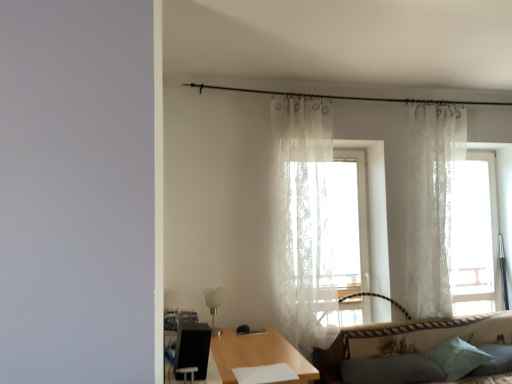
Describe the element at coordinates (391, 370) in the screenshot. The width and height of the screenshot is (512, 384). I see `dark gray fabric pillow at lower right, the 1th pillow positioned from the left` at that location.

What do you see at coordinates (192, 350) in the screenshot? The width and height of the screenshot is (512, 384). I see `black textured swivel chair at lower left` at bounding box center [192, 350].

Find the location of a particular element. The image size is (512, 384). black textured swivel chair at lower left is located at coordinates (192, 350).

Measure the distance between light blue fabric pillow at lower right, the 2th pillow positioned from the left, and camera.

light blue fabric pillow at lower right, the 2th pillow positioned from the left, and camera are 2.96 meters apart.

Describe the element at coordinates (214, 305) in the screenshot. The width and height of the screenshot is (512, 384). I see `white glass lamp at lower center` at that location.

What do you see at coordinates (413, 350) in the screenshot? The height and width of the screenshot is (384, 512). I see `patterned fabric couch at lower right` at bounding box center [413, 350].

Measure the distance between point (440, 276) and camera.

3.36 meters.

You are a GUI agent. You are given a task and a screenshot of the screen. Output one action in this format:
    pyautogui.click(x=<x>, y=<y>)
    Task: Click on the dark gray fabric pillow at lower right, acting as the third pillow starting from the right
    
    Given the screenshot: What is the action you would take?
    pyautogui.click(x=391, y=370)

Looking at this image, considering the relative sizes of sheer white curtain at center, the second curtain in the right-to-left sequence, and white lace curtain at upper right, which ranks as the 1th curtain in right-to-left order, in the image provided, is sheer white curtain at center, the second curtain in the right-to-left sequence, smaller than white lace curtain at upper right, which ranks as the 1th curtain in right-to-left order,?

No.

Which is more to the left, sheer white curtain at center, which ranks as the first curtain in left-to-right order, or white lace curtain at upper right, the 2th curtain from the left?

Positioned to the left is sheer white curtain at center, which ranks as the first curtain in left-to-right order.

Is sheer white curtain at center, the second curtain in the right-to-left sequence, wider or thinner than white lace curtain at upper right, the 2th curtain from the left?

Considering their sizes, sheer white curtain at center, the second curtain in the right-to-left sequence, looks broader than white lace curtain at upper right, the 2th curtain from the left.

From a real-world perspective, relative to white lace curtain at upper right, which ranks as the 1th curtain in right-to-left order, is sheer white curtain at center, the second curtain in the right-to-left sequence, vertically above or below?

In terms of real-world spatial position, sheer white curtain at center, the second curtain in the right-to-left sequence, is below white lace curtain at upper right, which ranks as the 1th curtain in right-to-left order.

From the image's perspective, is transparent lace curtain at right located above soft blue pillow at lower right, which is the 1th pillow from right to left?

Correct, transparent lace curtain at right appears higher than soft blue pillow at lower right, which is the 1th pillow from right to left, in the image.

Between transparent lace curtain at right and soft blue pillow at lower right, which is the 1th pillow from right to left, which one has smaller width?

transparent lace curtain at right is thinner.

Identify the location of window that is above the soft blue pillow at lower right, acting as the third pillow starting from the left (from a real-world perspective). Image resolution: width=512 pixels, height=384 pixels. (475, 237).

Does transparent lace curtain at right contain soft blue pillow at lower right, acting as the third pillow starting from the left?

No, soft blue pillow at lower right, acting as the third pillow starting from the left, is not surrounded by transparent lace curtain at right.

Does point (465, 341) come farther from viewer compared to point (505, 293)?

That is False.

Measure the distance between light blue fabric pillow at lower right, the 2th pillow positioned from the left, and transparent lace curtain at right.

light blue fabric pillow at lower right, the 2th pillow positioned from the left, and transparent lace curtain at right are 77.09 centimeters apart from each other.

Is light blue fabric pillow at lower right, the 2th pillow positioned from the left, inside or outside of transparent lace curtain at right?

The correct answer is: outside.

From the image's perspective, who appears lower, light blue fabric pillow at lower right, acting as the second pillow starting from the right, or transparent lace curtain at right?

From the image's view, light blue fabric pillow at lower right, acting as the second pillow starting from the right, is below.

Is point (498, 349) positioned before point (490, 154)?

Yes, point (498, 349) is closer to viewer.

Between soft blue pillow at lower right, which is the 1th pillow from right to left, and transparent lace curtain at right, which one has smaller size?

Smaller between the two is soft blue pillow at lower right, which is the 1th pillow from right to left.

Which object is positioned more to the left, soft blue pillow at lower right, acting as the third pillow starting from the left, or transparent lace curtain at right?

soft blue pillow at lower right, acting as the third pillow starting from the left.

From a real-world perspective, is soft blue pillow at lower right, acting as the third pillow starting from the left, physically located above or below transparent lace curtain at right?

From a real-world perspective, soft blue pillow at lower right, acting as the third pillow starting from the left, is physically below transparent lace curtain at right.

Considering the positions of objects patterned fabric couch at lower right and white lace curtain at upper right, the 2th curtain from the left, in the image provided, who is more to the right, patterned fabric couch at lower right or white lace curtain at upper right, the 2th curtain from the left,?

From the viewer's perspective, white lace curtain at upper right, the 2th curtain from the left, appears more on the right side.

Find the location of a particular element. The width and height of the screenshot is (512, 384). studio couch on the left of white lace curtain at upper right, the 2th curtain from the left is located at coordinates (413, 350).

Can you tell me how much patterned fabric couch at lower right and white lace curtain at upper right, which ranks as the 1th curtain in right-to-left order, differ in facing direction?

They differ by 2.18 degrees in their facing directions.

Is patterned fabric couch at lower right completely or partially outside of white lace curtain at upper right, which ranks as the 1th curtain in right-to-left order?

Yes, patterned fabric couch at lower right is outside of white lace curtain at upper right, which ranks as the 1th curtain in right-to-left order.

Is white glass lamp at lower center turned away from black textured swivel chair at lower left?

No.

Would you consider white glass lamp at lower center to be distant from black textured swivel chair at lower left?

No, white glass lamp at lower center is not far from black textured swivel chair at lower left.

Considering the positions of points (212, 304) and (197, 349), is point (212, 304) closer to camera compared to point (197, 349)?

No, it is not.

Do you think white glass lamp at lower center is within black textured swivel chair at lower left, or outside of it?

white glass lamp at lower center exists outside the volume of black textured swivel chair at lower left.

Which of these two, white lace curtain at upper right, the 2th curtain from the left, or light blue fabric pillow at lower right, the 2th pillow positioned from the left, is wider?

With larger width is light blue fabric pillow at lower right, the 2th pillow positioned from the left.

From the image's perspective, is white lace curtain at upper right, the 2th curtain from the left, positioned above or below light blue fabric pillow at lower right, the 2th pillow positioned from the left?

From the image's perspective, white lace curtain at upper right, the 2th curtain from the left, appears above light blue fabric pillow at lower right, the 2th pillow positioned from the left.

Which is in front, point (431, 282) or point (457, 367)?

The point (457, 367) is in front.

Based on the photo, between white lace curtain at upper right, which ranks as the 1th curtain in right-to-left order, and light blue fabric pillow at lower right, the 2th pillow positioned from the left, which one appears on the left side from the viewer's perspective?

From the viewer's perspective, light blue fabric pillow at lower right, the 2th pillow positioned from the left, appears more on the left side.

Locate an element on the screen. curtain lying below the white lace curtain at upper right, which ranks as the 1th curtain in right-to-left order (from the image's perspective) is located at coordinates (304, 221).

Starting from the transparent lace curtain at right, which pillow is the 1st one to the left? Please provide its 2D coordinates.

[(494, 361)]

Estimate the real-world distances between objects in this image. Which object is further from white glass lamp at lower center, wooden table at center or white lace curtain at upper right, the 2th curtain from the left?

white lace curtain at upper right, the 2th curtain from the left, is further to white glass lamp at lower center.

Estimate the real-world distances between objects in this image. Which object is closer to soft blue pillow at lower right, which is the 1th pillow from right to left, transparent lace curtain at right or black textured swivel chair at lower left?

Based on the image, transparent lace curtain at right appears to be nearer to soft blue pillow at lower right, which is the 1th pillow from right to left.

From the image, which object appears to be farther from dark gray fabric pillow at lower right, acting as the third pillow starting from the right, sheer white curtain at center, which ranks as the first curtain in left-to-right order, or soft blue pillow at lower right, acting as the third pillow starting from the left?

sheer white curtain at center, which ranks as the first curtain in left-to-right order, is further to dark gray fabric pillow at lower right, acting as the third pillow starting from the right.

From the image, which object appears to be nearer to transparent lace curtain at right, sheer white curtain at center, which ranks as the first curtain in left-to-right order, or white glass lamp at lower center?

sheer white curtain at center, which ranks as the first curtain in left-to-right order, is positioned closer to the anchor transparent lace curtain at right.

From the image, which object appears to be farther from white lace curtain at upper right, which ranks as the 1th curtain in right-to-left order, dark gray fabric pillow at lower right, acting as the third pillow starting from the right, or white glass lamp at lower center?

white glass lamp at lower center is positioned further to the anchor white lace curtain at upper right, which ranks as the 1th curtain in right-to-left order.

Looking at this image, which object lies nearer to the anchor point wooden table at center, sheer white curtain at center, the second curtain in the right-to-left sequence, or patterned fabric couch at lower right?

Based on the image, sheer white curtain at center, the second curtain in the right-to-left sequence, appears to be nearer to wooden table at center.

Considering their positions, is white lace curtain at upper right, the 2th curtain from the left, positioned closer to wooden table at center than transparent lace curtain at right?

Based on the image, white lace curtain at upper right, the 2th curtain from the left, appears to be nearer to wooden table at center.

When comparing their distances from dark gray fabric pillow at lower right, acting as the third pillow starting from the right, does black textured swivel chair at lower left or patterned fabric couch at lower right seem closer?

patterned fabric couch at lower right lies closer to dark gray fabric pillow at lower right, acting as the third pillow starting from the right, than the other object.

You are a GUI agent. You are given a task and a screenshot of the screen. Output one action in this format:
    pyautogui.click(x=<x>, y=<y>)
    Task: Click on the lamp between black textured swivel chair at lower left and white lace curtain at upper right, which ranks as the 1th curtain in right-to-left order, from left to right
    The image size is (512, 384).
    Given the screenshot: What is the action you would take?
    pyautogui.click(x=214, y=305)

Identify the location of pillow between wooden table at center and light blue fabric pillow at lower right, the 2th pillow positioned from the left, from left to right. (391, 370).

The width and height of the screenshot is (512, 384). What are the coordinates of `studio couch located between white glass lamp at lower center and transparent lace curtain at right in the left-right direction` in the screenshot? It's located at (413, 350).

At what (x,y) coordinates should I click in order to perform the action: click on window that lies between white lace curtain at upper right, which ranks as the 1th curtain in right-to-left order, and soft blue pillow at lower right, which is the 1th pillow from right to left, from top to bottom. Please return your answer as a coordinate pair (x, y). The image size is (512, 384). Looking at the image, I should click on (475, 237).